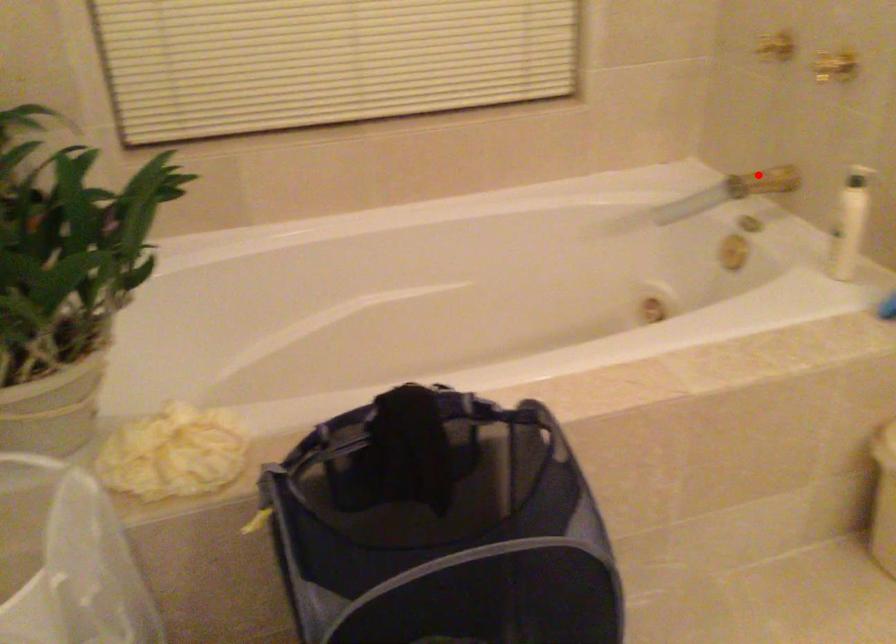
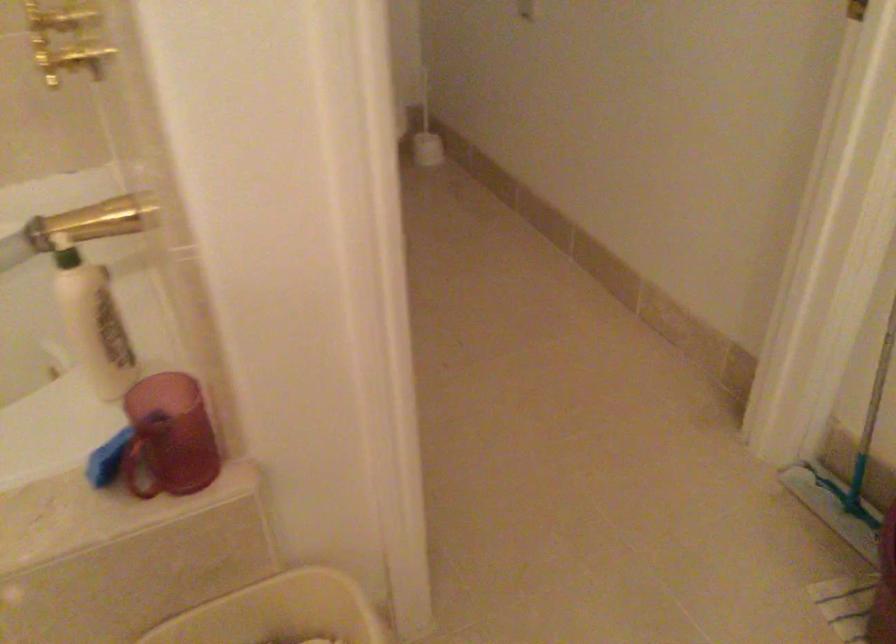
Find the pixel in the second image that matches the highlighted location in the first image.

(95, 222)